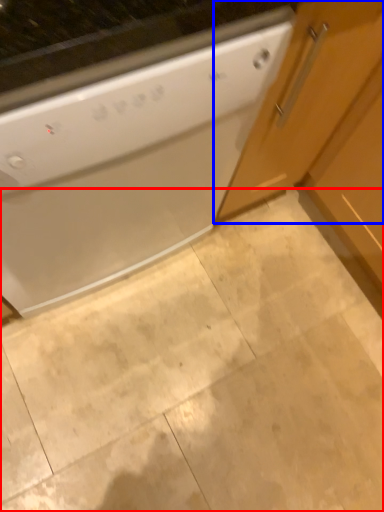
Question: Which object appears farthest to the camera in this image, granite (highlighted by a red box) or cabinetry (highlighted by a blue box)?

Choices:
 (A) granite
 (B) cabinetry

Answer: (A)